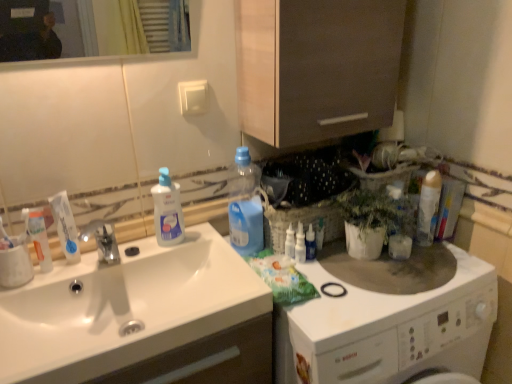
This screenshot has height=384, width=512. What are the coordinates of `vacant space in front of white glossy toothpaste at left` in the screenshot? It's located at (53, 285).